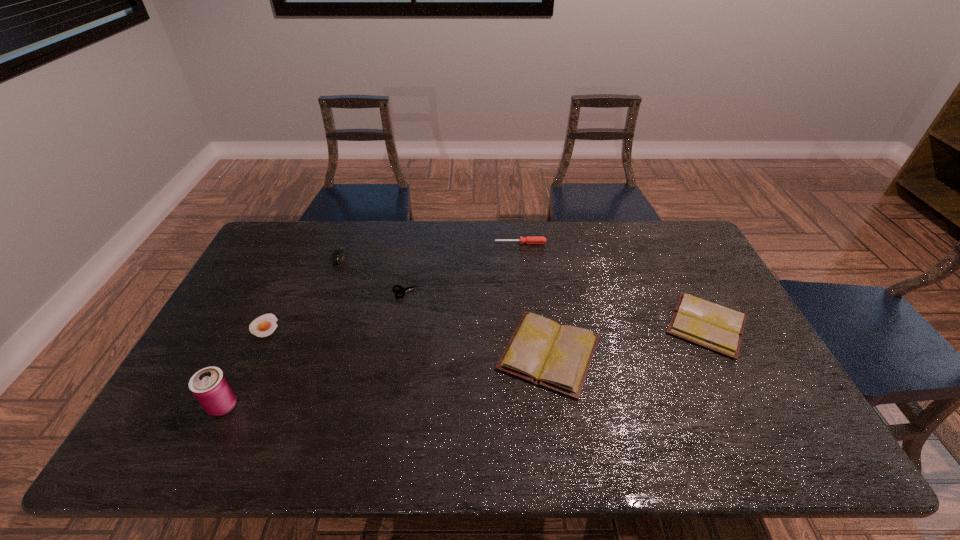
Where is `the taller diary`? The height and width of the screenshot is (540, 960). the taller diary is located at coordinates (557, 356).

You are a GUI agent. You are given a task and a screenshot of the screen. Output one action in this format:
    pyautogui.click(x=<x>, y=<y>)
    Task: Click on the right diary
    The width and height of the screenshot is (960, 540).
    Given the screenshot: What is the action you would take?
    pyautogui.click(x=709, y=325)

Locate an element on the screen. the shorter diary is located at coordinates (709, 325).

Locate an element on the screen. The width and height of the screenshot is (960, 540). the farthest object is located at coordinates (529, 239).

The image size is (960, 540). In order to click on the sixth nearest object in this screenshot , I will do `click(340, 254)`.

You are a GUI agent. You are given a task and a screenshot of the screen. Output one action in this format:
    pyautogui.click(x=<x>, y=<y>)
    Task: Click on the computer mouse
    Image resolution: width=960 pixels, height=540 pixels.
    Given the screenshot: What is the action you would take?
    pyautogui.click(x=340, y=254)

At what (x,y) coordinates should I click in order to perform the action: click on the shortest object. Please return your answer as a coordinate pair (x, y). Looking at the image, I should click on (263, 326).

The height and width of the screenshot is (540, 960). Find the location of `the fourth object from right to left`. the fourth object from right to left is located at coordinates (402, 290).

Locate an element on the screen. The height and width of the screenshot is (540, 960). shears is located at coordinates (402, 290).

At what (x,y) coordinates should I click in order to perform the action: click on the tallest object. Please return your answer as a coordinate pair (x, y). Looking at the image, I should click on (210, 386).